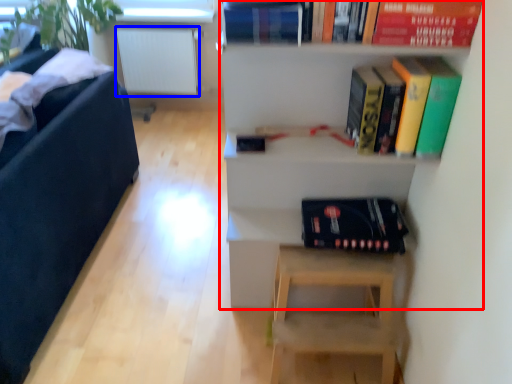
Question: Among these objects, which one is nearest to the camera, shelf (highlighted by a red box) or radiator (highlighted by a blue box)?

Choices:
 (A) shelf
 (B) radiator

Answer: (A)